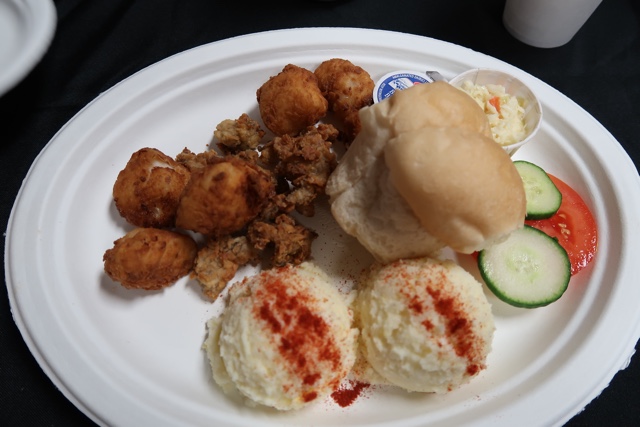
Find the location of a particular element. The width and height of the screenshot is (640, 427). plates is located at coordinates (152, 330), (11, 37).